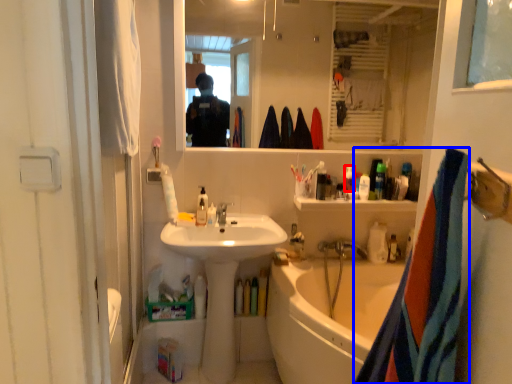
Question: Which of the following is the closest to the observer, toiletry (highlighted by a red box) or towel/napkin (highlighted by a blue box)?

Choices:
 (A) toiletry
 (B) towel/napkin

Answer: (B)